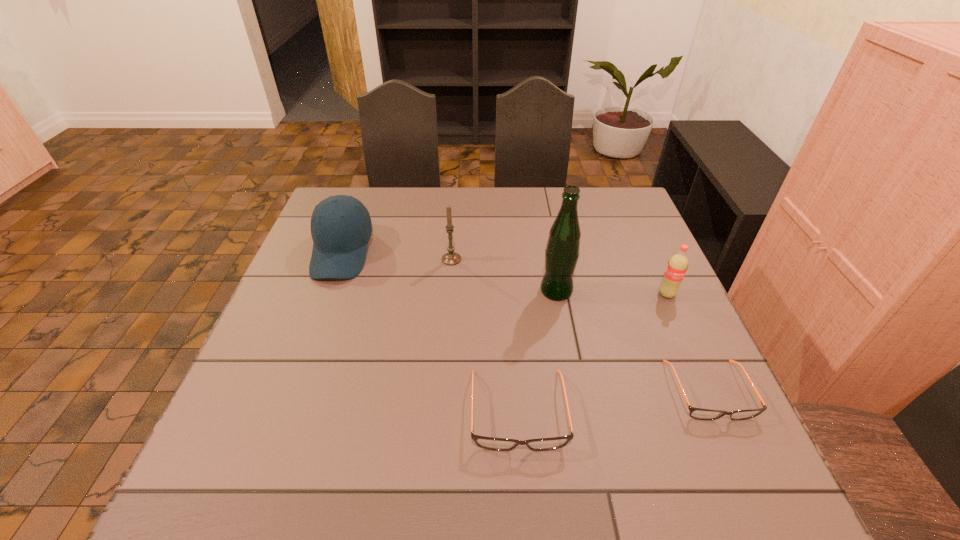
The height and width of the screenshot is (540, 960). Find the location of `vacant space at the right edge of the desktop`. vacant space at the right edge of the desktop is located at coordinates (636, 346).

You are a GUI agent. You are given a task and a screenshot of the screen. Output one action in this format:
    pyautogui.click(x=<x>, y=<y>)
    Task: Click on the free space at the far left corner
    
    Given the screenshot: What is the action you would take?
    pyautogui.click(x=353, y=190)

Locate an element on the screen. The image size is (960, 540). empty location between the candle and the left spectacles is located at coordinates (485, 335).

Find the location of a particular element. The width and height of the screenshot is (960, 540). vacant region between the tallest object and the candle is located at coordinates (504, 275).

Find the location of a particular element. Image resolution: width=960 pixels, height=540 pixels. empty space between the beer bottle and the soda is located at coordinates (612, 293).

At what (x,y) coordinates should I click in order to perform the action: click on free space between the soda and the beer bottle. Please return your answer as a coordinate pair (x, y). Image resolution: width=960 pixels, height=540 pixels. Looking at the image, I should click on (612, 293).

Identify the location of vacant area that lies between the leftmost object and the left spectacles. The width and height of the screenshot is (960, 540). (430, 332).

At what (x,y) coordinates should I click in order to perform the action: click on free space between the tallest object and the candle. Please return your answer as a coordinate pair (x, y). The height and width of the screenshot is (540, 960). Looking at the image, I should click on (504, 275).

Identify the location of free area in between the fifth object from right to left and the taller spectacles. This screenshot has width=960, height=540. (485, 335).

The height and width of the screenshot is (540, 960). In order to click on vacant area between the baseball cap and the fifth tallest object in this screenshot , I will do `click(430, 332)`.